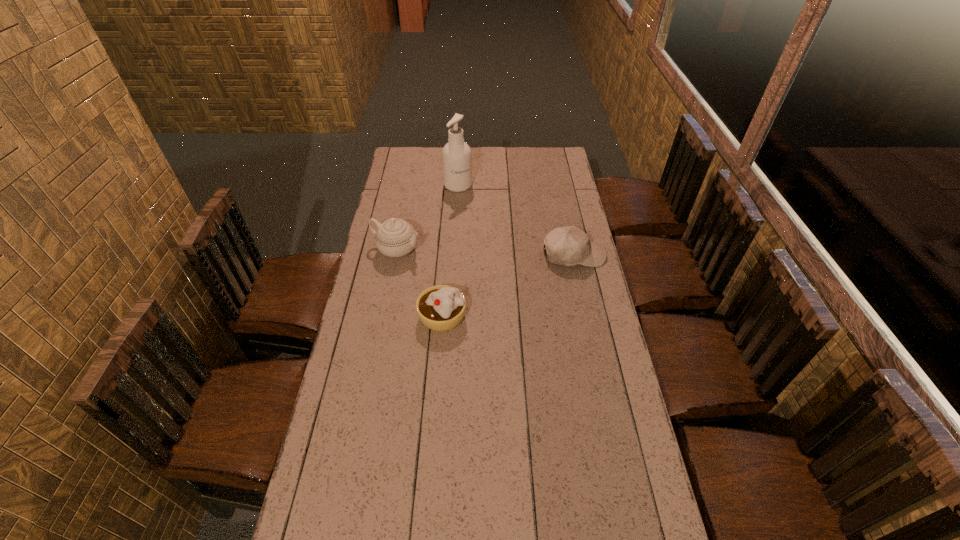
What are the coordinates of `object that is the closest to the baseball cap` in the screenshot? It's located at (442, 307).

The image size is (960, 540). I want to click on object identified as the closest to the whipped cream, so click(395, 237).

Find the location of a particular element. The height and width of the screenshot is (540, 960). vacant space that satisfies the following two spatial constraints: 1. on the back side of the farthest object; 2. on the left side of the nearest object is located at coordinates (452, 185).

Identify the location of vacant space that satisfies the following two spatial constraints: 1. on the front side of the second tallest object; 2. on the front-facing side of the baseball cap. (396, 255).

At what (x,y) coordinates should I click in order to perform the action: click on vacant region that satisfies the following two spatial constraints: 1. on the back side of the leftmost object; 2. on the left side of the tallest object. Please return your answer as a coordinate pair (x, y). Looking at the image, I should click on (409, 185).

At what (x,y) coordinates should I click in order to perform the action: click on free spot that satisfies the following two spatial constraints: 1. on the back side of the rightmost object; 2. on the front-facing side of the whipped cream. Please return your answer as a coordinate pair (x, y). Looking at the image, I should click on (446, 255).